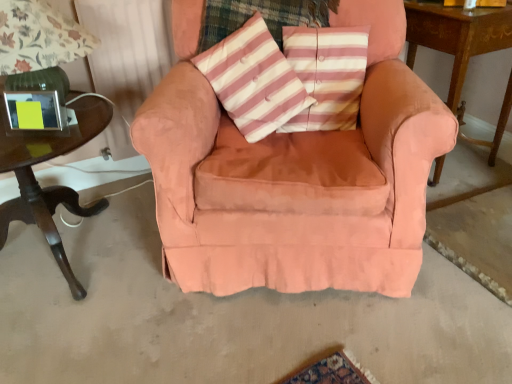
Question: Is pink striped cushion at center positioned beyond the bounds of dark wood table at left, positioned as the second table in right-to-left order?

Choices:
 (A) no
 (B) yes

Answer: (B)

Question: Considering the relative sizes of pink striped cushion at center and dark wood table at left, positioned as the first table in left-to-right order, in the image provided, is pink striped cushion at center wider than dark wood table at left, positioned as the first table in left-to-right order,?

Choices:
 (A) yes
 (B) no

Answer: (B)

Question: From the image's perspective, is pink striped cushion at center beneath dark wood table at left, positioned as the second table in right-to-left order?

Choices:
 (A) no
 (B) yes

Answer: (A)

Question: From a real-world perspective, does pink striped cushion at center sit lower than dark wood table at left, positioned as the first table in left-to-right order?

Choices:
 (A) no
 (B) yes

Answer: (A)

Question: Does pink striped cushion at center contain dark wood table at left, positioned as the first table in left-to-right order?

Choices:
 (A) yes
 (B) no

Answer: (B)

Question: From a real-world perspective, relative to dark wood table at left, positioned as the first table in left-to-right order, is pink striped fabric pillow at center vertically above or below?

Choices:
 (A) below
 (B) above

Answer: (B)

Question: In terms of height, does pink striped fabric pillow at center look taller or shorter compared to dark wood table at left, positioned as the first table in left-to-right order?

Choices:
 (A) short
 (B) tall

Answer: (A)

Question: Is pink striped fabric pillow at center inside the boundaries of dark wood table at left, positioned as the second table in right-to-left order, or outside?

Choices:
 (A) outside
 (B) inside

Answer: (A)

Question: Considering the relative positions of pink striped fabric pillow at center and dark wood table at left, positioned as the second table in right-to-left order, in the image provided, is pink striped fabric pillow at center to the left or to the right of dark wood table at left, positioned as the second table in right-to-left order,?

Choices:
 (A) left
 (B) right

Answer: (B)

Question: Which is correct: dark wood table at left, positioned as the first table in left-to-right order, is inside wooden table at right, arranged as the 1th table when viewed from the right, or outside of it?

Choices:
 (A) inside
 (B) outside

Answer: (B)

Question: Looking at their shapes, would you say dark wood table at left, positioned as the first table in left-to-right order, is wider or thinner than wooden table at right, the second table when ordered from left to right?

Choices:
 (A) thin
 (B) wide

Answer: (B)

Question: Visually, is dark wood table at left, positioned as the first table in left-to-right order, positioned to the left or to the right of wooden table at right, arranged as the 1th table when viewed from the right?

Choices:
 (A) right
 (B) left

Answer: (B)

Question: Is point (6, 168) positioned closer to the camera than point (429, 8)?

Choices:
 (A) closer
 (B) farther

Answer: (A)

Question: Would you say pink striped fabric pillow at center is inside or outside wooden table at right, arranged as the 1th table when viewed from the right?

Choices:
 (A) inside
 (B) outside

Answer: (B)

Question: Based on their sizes in the image, would you say pink striped fabric pillow at center is bigger or smaller than wooden table at right, arranged as the 1th table when viewed from the right?

Choices:
 (A) small
 (B) big

Answer: (A)